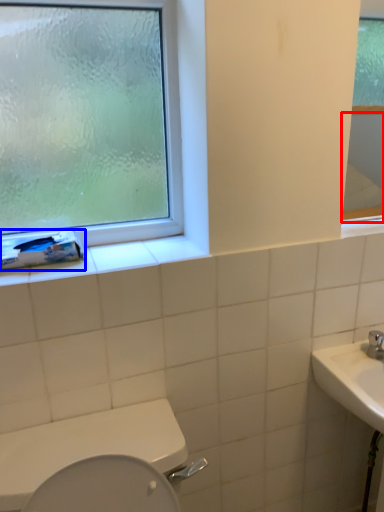
Question: Which of the following is the closest to the observer, mirror (highlighted by a red box) or toilet paper (highlighted by a blue box)?

Choices:
 (A) mirror
 (B) toilet paper

Answer: (B)